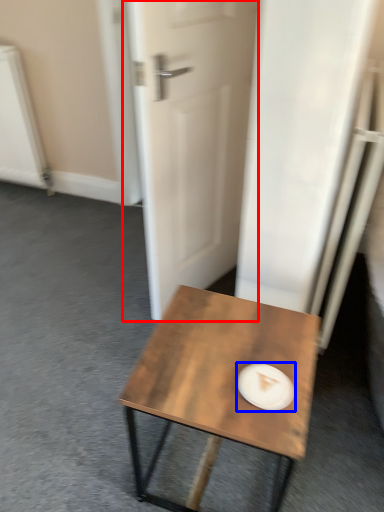
Question: Among these objects, which one is nearest to the camera, door (highlighted by a red box) or paper plate (highlighted by a blue box)?

Choices:
 (A) door
 (B) paper plate

Answer: (B)